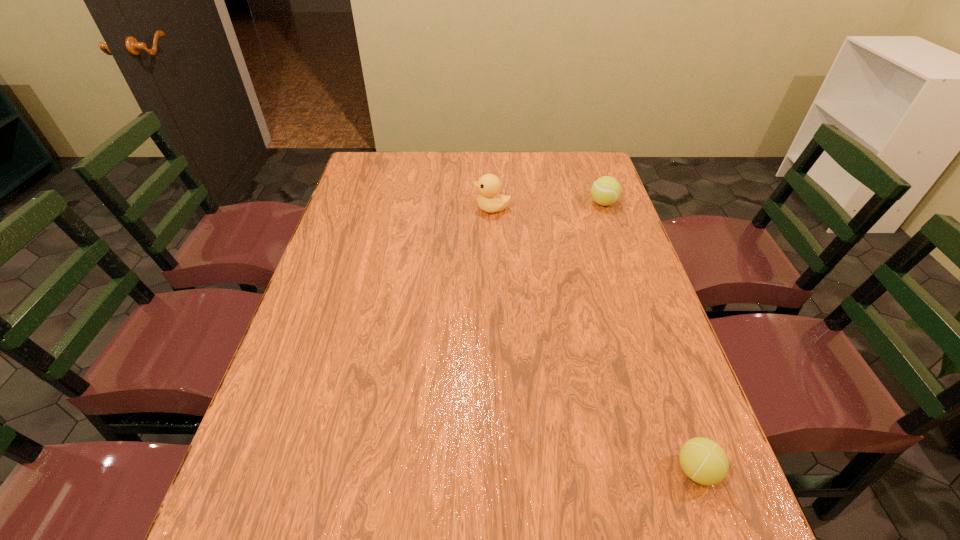
This screenshot has width=960, height=540. I want to click on free space located on the left of the nearest object, so 516,470.

Where is `vacant space at the far edge of the desktop`? The image size is (960, 540). vacant space at the far edge of the desktop is located at coordinates (440, 183).

Locate an element on the screen. vacant space at the left edge of the desktop is located at coordinates (325, 286).

In the image, there is a desktop. Where is `blank space at the right edge`? blank space at the right edge is located at coordinates (629, 374).

This screenshot has height=540, width=960. Identify the location of free space at the far right corner of the desktop. (563, 175).

Where is `vacant area between the shorter tennis ball and the taller tennis ball`? vacant area between the shorter tennis ball and the taller tennis ball is located at coordinates (650, 336).

Find the location of a particular element. vacant space that's between the tallest object and the nearest object is located at coordinates tap(594, 339).

I want to click on empty location between the leftmost object and the nearest object, so click(594, 339).

In order to click on empty space that is in between the nearer tennis ball and the tallest object in this screenshot , I will do `click(594, 339)`.

Where is `free spot between the shortest object and the second tallest object`? free spot between the shortest object and the second tallest object is located at coordinates (650, 336).